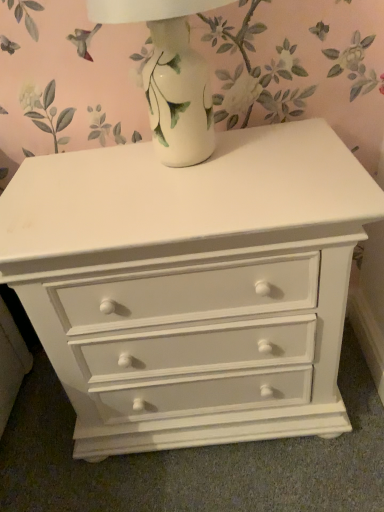
The height and width of the screenshot is (512, 384). What are the coordinates of `free spot above white painted wood chest of drawers at center (from a real-world perspective)` in the screenshot? It's located at (209, 175).